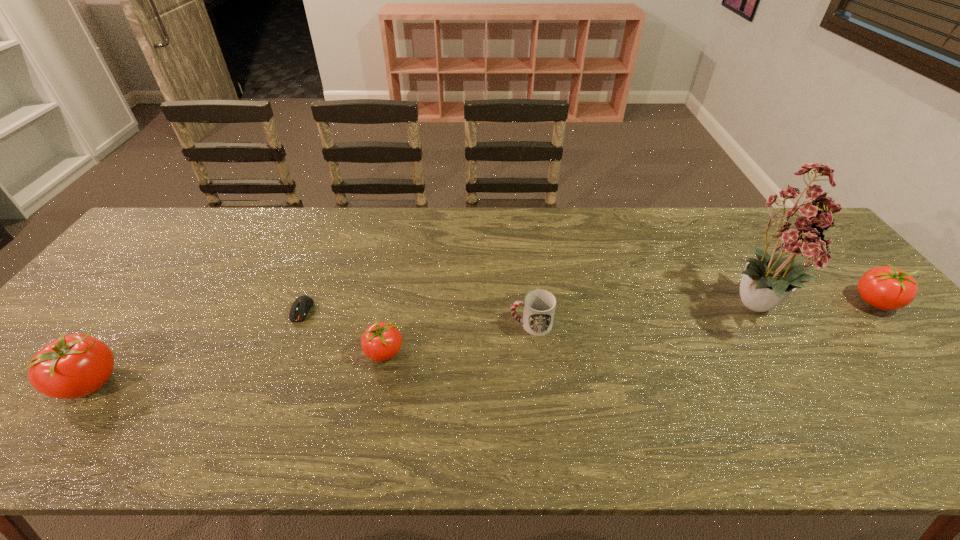
Identify the location of vacant region between the fourth object from left to right and the second object from right to left. click(645, 315).

This screenshot has height=540, width=960. Find the location of `free space between the shortest tomato and the third object from right to left`. free space between the shortest tomato and the third object from right to left is located at coordinates (457, 339).

Where is `free point between the leftmost tomato and the rightmost object`? This screenshot has height=540, width=960. free point between the leftmost tomato and the rightmost object is located at coordinates (483, 342).

At what (x,y) coordinates should I click in order to perform the action: click on unoccupied position between the computer equipment and the cup. Please return your answer as a coordinate pair (x, y). This screenshot has height=540, width=960. Looking at the image, I should click on (417, 318).

Identify the location of empty space between the cup and the fifth object from right to left. This screenshot has height=540, width=960. (417, 318).

The height and width of the screenshot is (540, 960). Find the location of `free spot between the second shortest tomato and the computer equipment`. free spot between the second shortest tomato and the computer equipment is located at coordinates (588, 306).

Locate an element on the screen. This screenshot has width=960, height=540. free spot between the fifth object from right to left and the shortest tomato is located at coordinates (343, 332).

Find the location of a particular element. The width and height of the screenshot is (960, 540). object that can be found as the second closest to the second tomato from left to right is located at coordinates pyautogui.click(x=539, y=305).

Select which object appears as the fourth closest to the leftmost object. Please provide its 2D coordinates. Your answer should be formatted as a tuple, i.e. [(x, y)], where the tuple contains the x and y coordinates of a point satisfying the conditions above.

[(800, 229)]

Select which tomato appears as the closest to the tallest tomato. Please provide its 2D coordinates. Your answer should be formatted as a tuple, i.e. [(x, y)], where the tuple contains the x and y coordinates of a point satisfying the conditions above.

[(381, 341)]